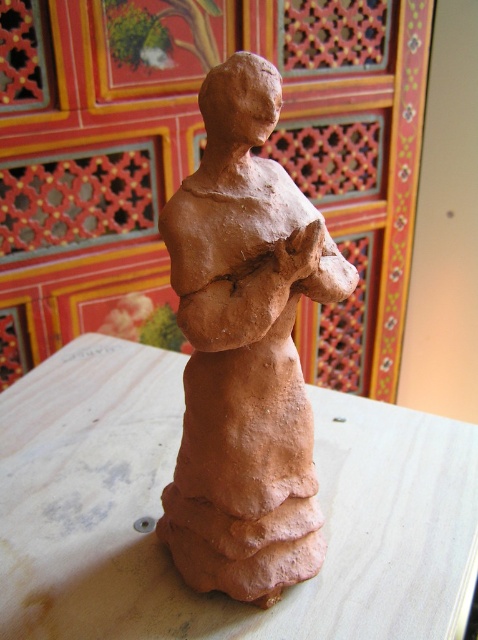
Between matte wood table at center and matte clay figure at center, which one has more height?

matte clay figure at center is taller.

Does matte wood table at center appear on the right side of matte clay figure at center?

In fact, matte wood table at center is to the left of matte clay figure at center.

Locate an element on the screen. matte wood table at center is located at coordinates (161, 512).

Identify the location of matte wood table at center. The width and height of the screenshot is (478, 640). (161, 512).